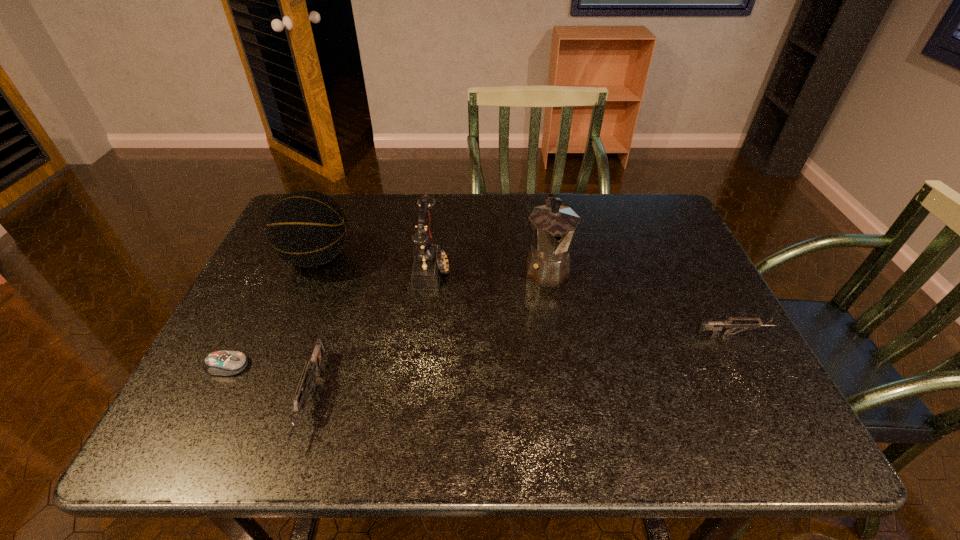
Please point a spot to place another gun for symmetrical spacing. Please provide its 2D coordinates. Your answer should be formatted as a tuple, i.e. [(x, y)], where the tuple contains the x and y coordinates of a point satisfying the conditions above.

[(536, 363)]